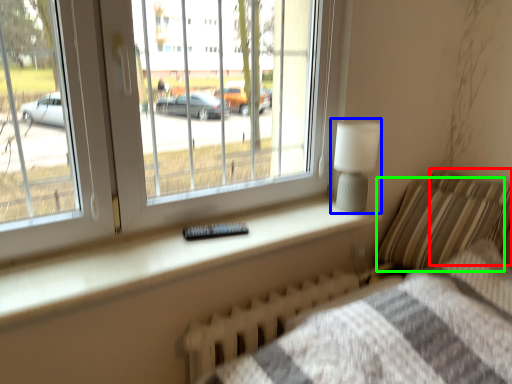
Question: Based on their relative distances, which object is nearer to pillow (highlighted by a red box)? Choose from table lamp (highlighted by a blue box) and pillow (highlighted by a green box).

Choices:
 (A) table lamp
 (B) pillow

Answer: (B)